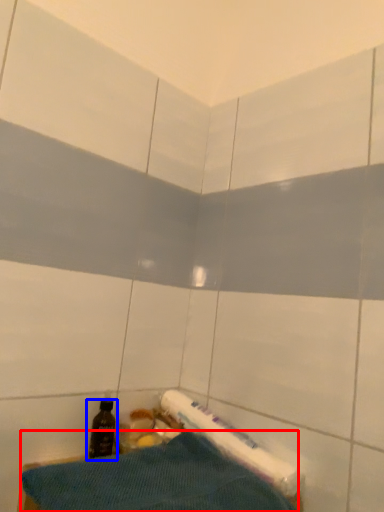
Question: Which of the following is the farthest to the observer, sheet (highlighted by a red box) or bottle (highlighted by a blue box)?

Choices:
 (A) sheet
 (B) bottle

Answer: (B)